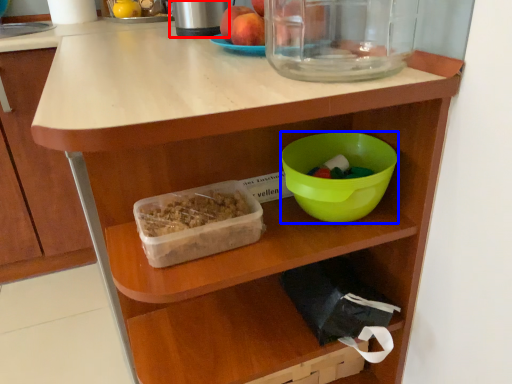
Question: Which of the following is the farthest to the observer, appliance (highlighted by a red box) or bowl (highlighted by a blue box)?

Choices:
 (A) appliance
 (B) bowl

Answer: (A)